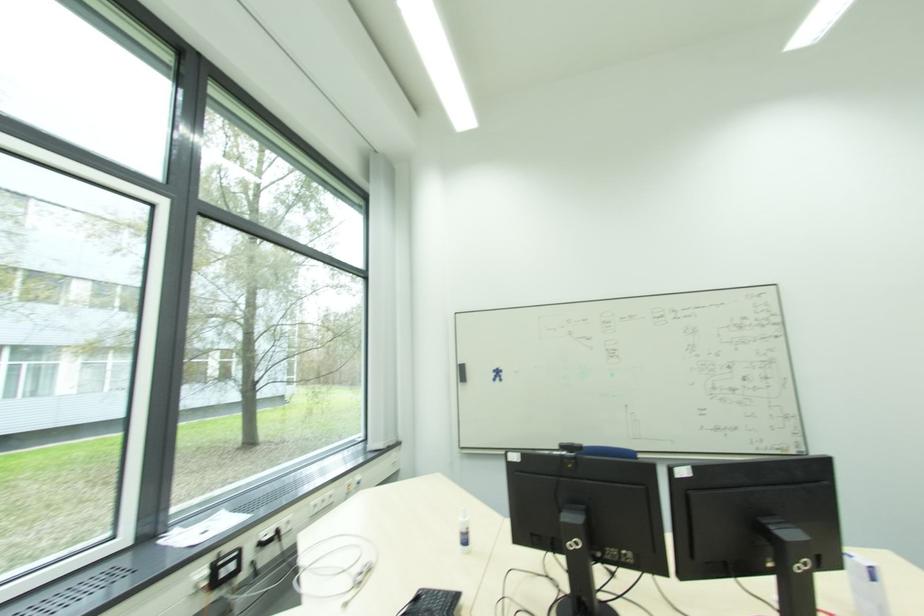
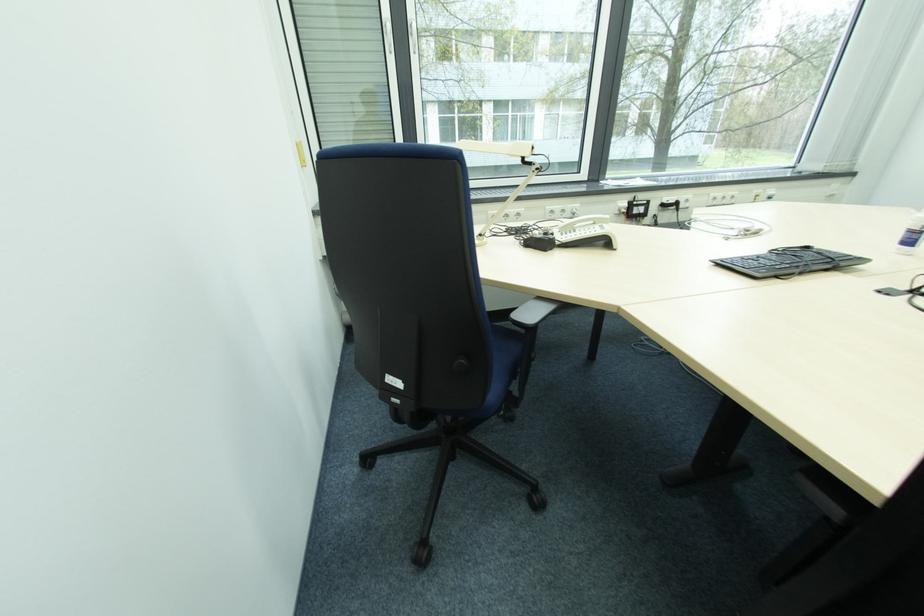
From the picture: The images are taken continuously from a first-person perspective. In which direction is your viewpoint rotating?

The camera's rotation is toward left-down.